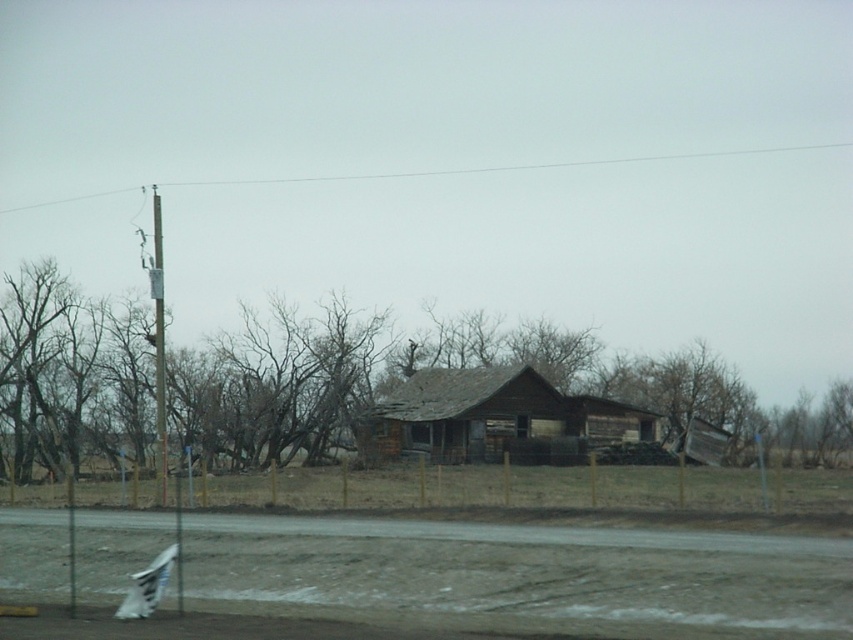
Question: Which point is farther from the camera taking this photo?

Choices:
 (A) (161, 358)
 (B) (724, 460)

Answer: (B)

Question: Is brown wooden fence at center below weathered wood hut at center?

Choices:
 (A) yes
 (B) no

Answer: (B)

Question: Is the position of weathered wood hut at center less distant than that of smooth gray pole at left?

Choices:
 (A) yes
 (B) no

Answer: (B)

Question: Which point appears farthest from the camera in this image?

Choices:
 (A) (527, 428)
 (B) (165, 428)
 (C) (105, 445)

Answer: (A)

Question: Does brown wooden fence at center lie behind smooth gray pole at left?

Choices:
 (A) no
 (B) yes

Answer: (B)

Question: Based on their relative distances, which object is farther from the brown wooden fence at center?

Choices:
 (A) weathered wood hut at center
 (B) smooth gray pole at left

Answer: (B)